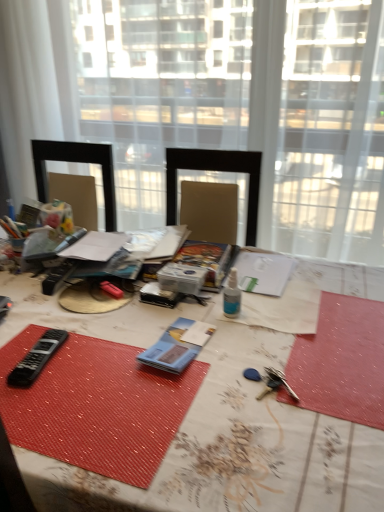
This screenshot has height=512, width=384. In order to click on vacant area that lies to the right of black plastic remote at lower left, the second equipment positioned from the right in this screenshot , I will do `click(109, 359)`.